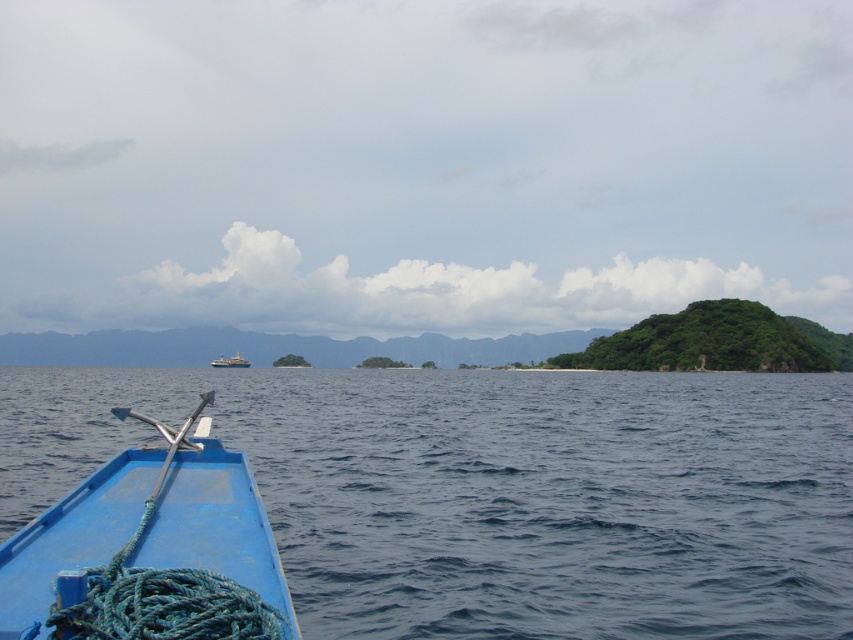
Who is lower down, green leafy island at right or white plastic boat at center?

white plastic boat at center is lower down.

Is green leafy island at right wider than white plastic boat at center?

Correct, the width of green leafy island at right exceeds that of white plastic boat at center.

You are a GUI agent. You are given a task and a screenshot of the screen. Output one action in this format:
    pyautogui.click(x=<x>, y=<y>)
    Task: Click on the green leafy island at right
    The height and width of the screenshot is (640, 853).
    Given the screenshot: What is the action you would take?
    pyautogui.click(x=717, y=342)

Who is lower down, blue water at lower left or blue matte boat at lower left?

blue water at lower left

Who is more forward, (843, 538) or (199, 456)?

Point (843, 538) is in front.

Between point (419, 380) and point (154, 518), which one is positioned behind?

The point (419, 380) is more distant.

The height and width of the screenshot is (640, 853). I want to click on blue water at lower left, so click(498, 492).

Is blue matte boat at lower left to the right of white plastic boat at center from the viewer's perspective?

Indeed, blue matte boat at lower left is positioned on the right side of white plastic boat at center.

I want to click on blue matte boat at lower left, so click(149, 550).